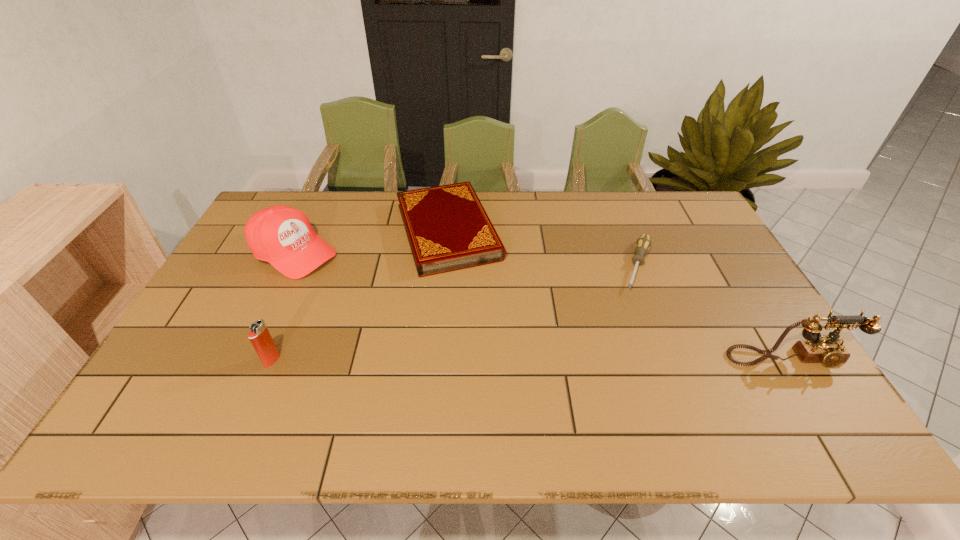
At what (x,y) coordinates should I click in order to perform the action: click on vacant area situated 0.080m at the tip of the second object from right to left. Please return your answer as a coordinate pair (x, y). Looking at the image, I should click on (634, 310).

Image resolution: width=960 pixels, height=540 pixels. In order to click on vacant space situated 0.270m at the tip of the second object from right to left in this screenshot , I will do `click(618, 362)`.

The width and height of the screenshot is (960, 540). I want to click on free space located 0.300m at the tip of the second object from right to left, so click(x=615, y=371).

At what (x,y) coordinates should I click in order to perform the action: click on free region located 0.140m on the front panel of the baseball cap. Please return your answer as a coordinate pair (x, y). This screenshot has height=540, width=960. Looking at the image, I should click on (355, 287).

Identify the location of vacant region located on the front panel of the baseball cap. (371, 296).

I want to click on vacant position located on the front panel of the baseball cap, so click(339, 278).

Identify the location of hardback book that is at the far edge. point(448,229).

At what (x,y) coordinates should I click in order to perform the action: click on baseball cap that is at the far edge. Please return your answer as a coordinate pair (x, y). Looking at the image, I should click on (281, 235).

The image size is (960, 540). I want to click on igniter that is positioned at the near edge, so click(259, 335).

Where is `telephone at the near edge`? telephone at the near edge is located at coordinates click(829, 350).